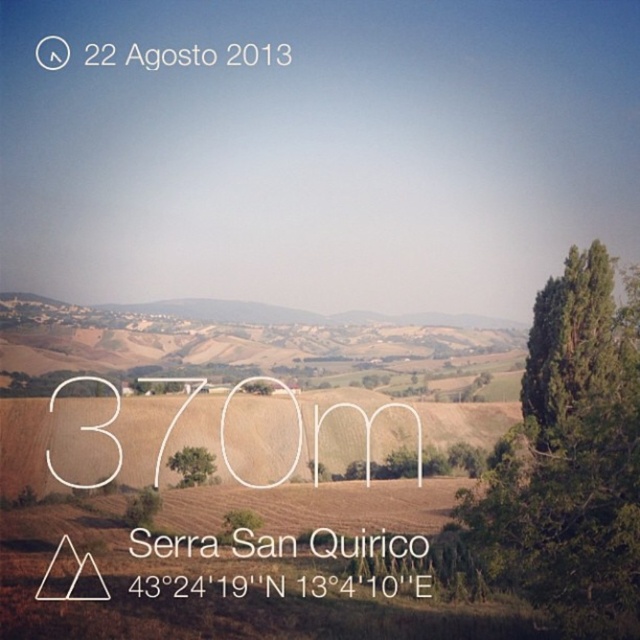
You are standing in the middle of the field and see the brown grassy hill at center and the green leafy tree at center. Which object is closer to you?

The brown grassy hill at center is closer to you because the green leafy tree at center is positioned behind it.

You are standing in the rural landscape shown in the image and want to walk from the green leafy tree at right to the green leafy tree at center. Which direction should you move relative to the tree you are currently at?

You should move away from the viewer since the green leafy tree at right is closer to you than the green leafy tree at center, which is further away.